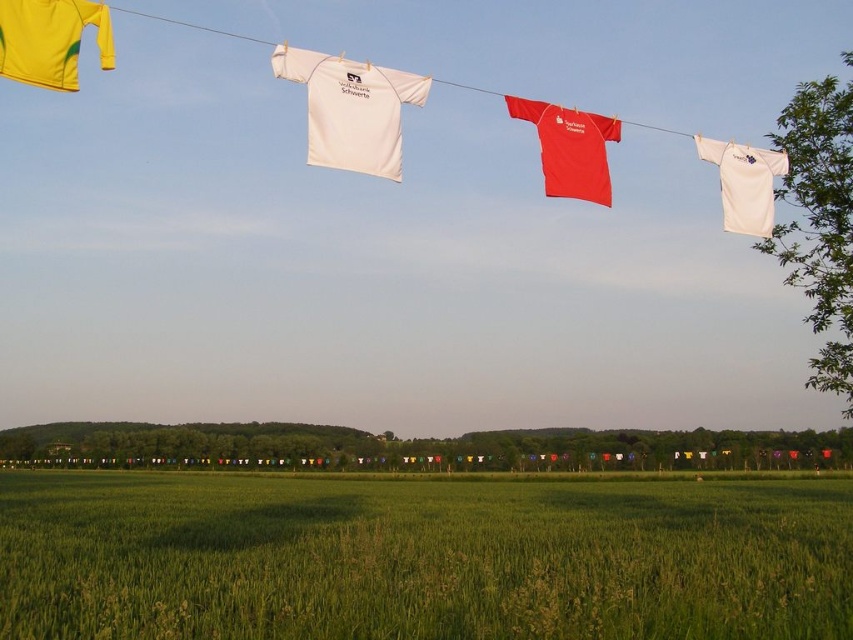
This screenshot has height=640, width=853. What do you see at coordinates (351, 109) in the screenshot?
I see `white fabric shirt at center` at bounding box center [351, 109].

Between white fabric shirt at center and matte red t-shirt at center, which one has more height?

white fabric shirt at center is taller.

Which is in front, point (386, 176) or point (541, 125)?

Point (386, 176) is more forward.

You are a GUI agent. You are given a task and a screenshot of the screen. Output one action in this format:
    pyautogui.click(x=<x>, y=<y>)
    Task: Click on the white fabric shirt at center
    The image size is (853, 640).
    Given the screenshot: What is the action you would take?
    pyautogui.click(x=351, y=109)

Between green leafy tree at center and white matte t-shirt at upper center, which one is positioned higher?

Positioned higher is white matte t-shirt at upper center.

Who is taller, green leafy tree at center or white matte t-shirt at upper center?

With more height is white matte t-shirt at upper center.

Is point (271, 465) positioned after point (769, 154)?

Yes, it is behind point (769, 154).

What are the coordinates of `green leafy tree at center` in the screenshot? It's located at (416, 448).

Between green grass at lower center and white matte t-shirt at upper center, which one appears on the right side from the viewer's perspective?

From the viewer's perspective, white matte t-shirt at upper center appears more on the right side.

This screenshot has height=640, width=853. What are the coordinates of `green grass at lower center` in the screenshot? It's located at (421, 557).